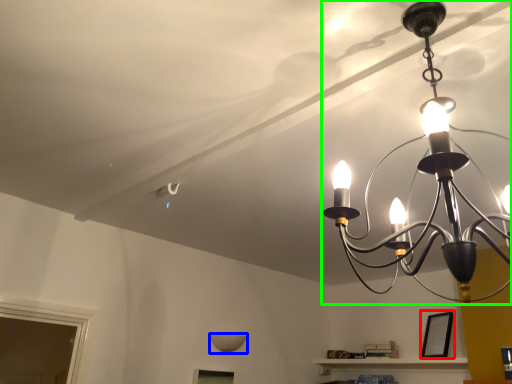
Question: Considering the real-world distances, which object is farthest from picture frame (highlighted by a red box)? lamp (highlighted by a blue box) or lamp (highlighted by a green box)?

Choices:
 (A) lamp
 (B) lamp

Answer: (B)